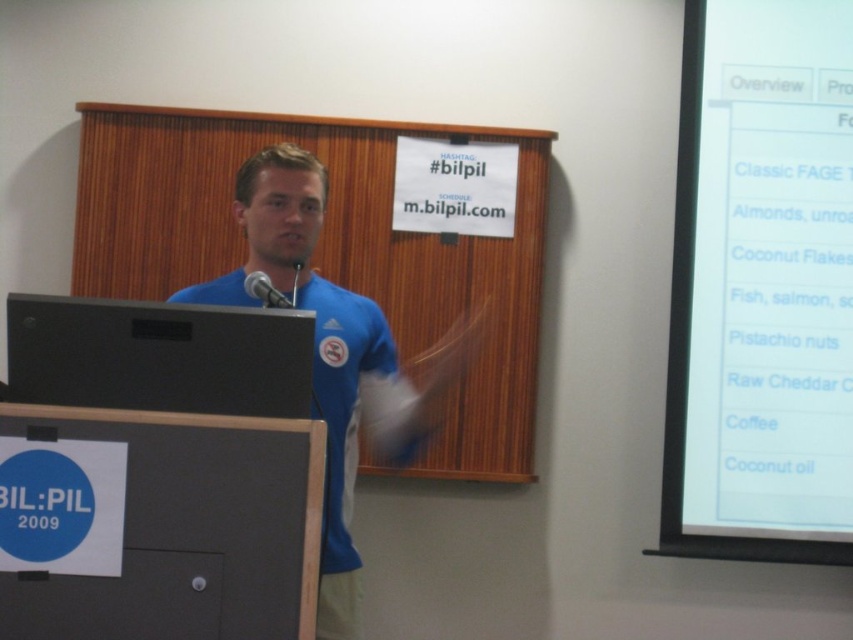
You are an event organizer trying to set up a stage for a speaker. You have a blue fabric shirt at center and a black matte speaker at left. Based on the scene, which object is wider?

The blue fabric shirt at center is wider than the black matte speaker at left.

You are attending a lecture and notice the wooden at center and the blue fabric shirt at center. Which object is located higher in the image?

The wooden at center is positioned over the blue fabric shirt at center, so it is higher in the image.

You are a photographer standing behind the speaker. You want to take a photo of the wooden at center and the blue fabric shirt at center. Which object should you focus on first to ensure it is in sharp focus?

You should focus on the wooden at center first because it is closer to you than the blue fabric shirt at center, so it requires being in focus before the other object.